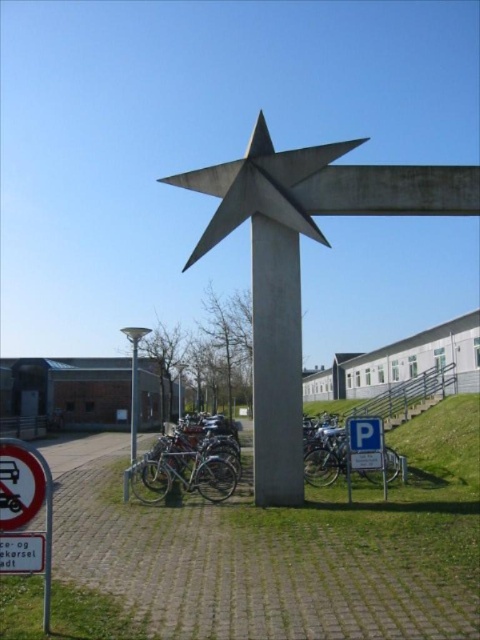
Question: Which of the following is the farthest from the observer?

Choices:
 (A) gray metal sign at lower left
 (B) satin silver star at center
 (C) white plastic parking sign at lower right

Answer: (C)

Question: Does satin silver star at center appear over white plastic parking sign at lower right?

Choices:
 (A) yes
 (B) no

Answer: (A)

Question: Is silver metallic bicycle at center further to the viewer compared to gray metal sign at lower left?

Choices:
 (A) yes
 (B) no

Answer: (A)

Question: Which object is closer to the camera taking this photo?

Choices:
 (A) gray metal sign at lower left
 (B) silver metallic bicycle at center
 (C) satin silver star at center

Answer: (A)

Question: In this image, where is satin silver star at center located relative to white plastic parking sign at lower right?

Choices:
 (A) below
 (B) above

Answer: (B)

Question: Estimate the real-world distances between objects in this image. Which object is closer to the white plastic parking sign at lower right?

Choices:
 (A) silver metallic bicycle at center
 (B) satin silver star at center
 (C) gray metal sign at lower left

Answer: (A)